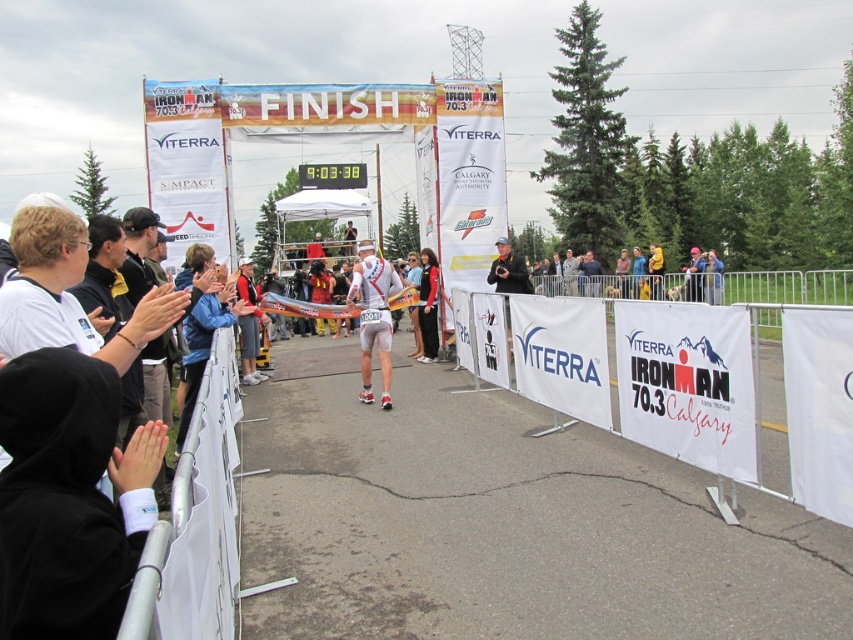
You are a photographer standing at the finish line of the Ironman 70.3 Calgary race. You want to take a photo that includes both the point at coordinates point (x=195, y=499) and the point at coordinates point (x=381, y=317). Which point will appear larger in your photo?

Point (x=195, y=499) will appear larger in the photo because it is closer to the camera than point (x=381, y=317).

You are a photographer standing at the finish line of the Ironman 70.3 Calgary race. You want to take a photo of the crowd behind the white plastic barrier at lower left without including the barrier in the shot. Can you step back enough to do this?

The white plastic barrier at lower left is 1.19 meters away from the camera. To avoid capturing the barrier in the photo, you would need to step back far enough so that the barrier is no longer in the frame. However, since the barrier is only 1.19 meters away, stepping back might not be sufficient if the camera angle includes the barrier at that distance. The feasibility depends on the camera lens and field of view, but given the short distance, it might be challenging to exclude the barrier without moving.